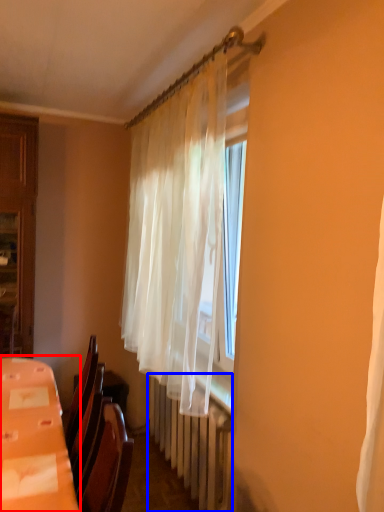
Question: Which object is further to the camera taking this photo, table (highlighted by a red box) or radiator (highlighted by a blue box)?

Choices:
 (A) table
 (B) radiator

Answer: (B)